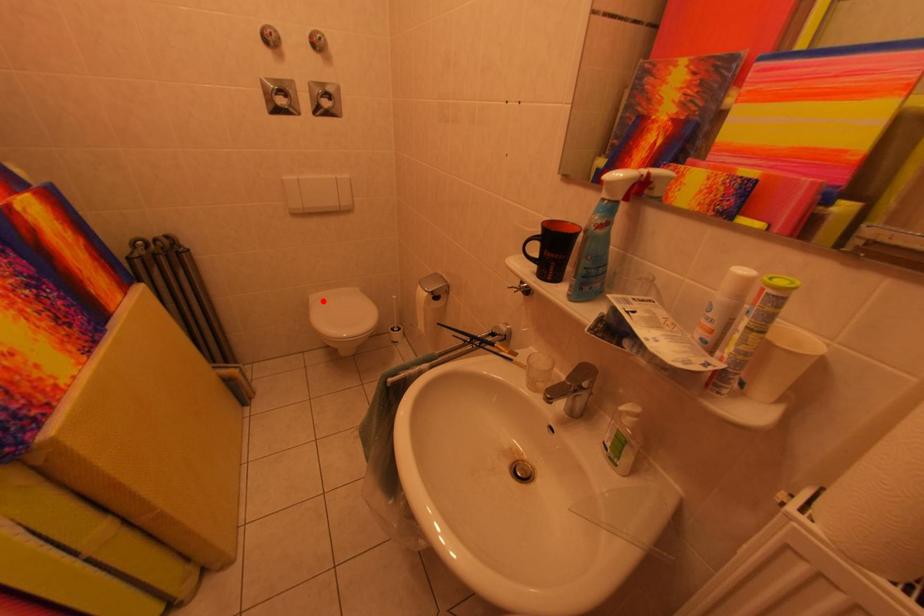
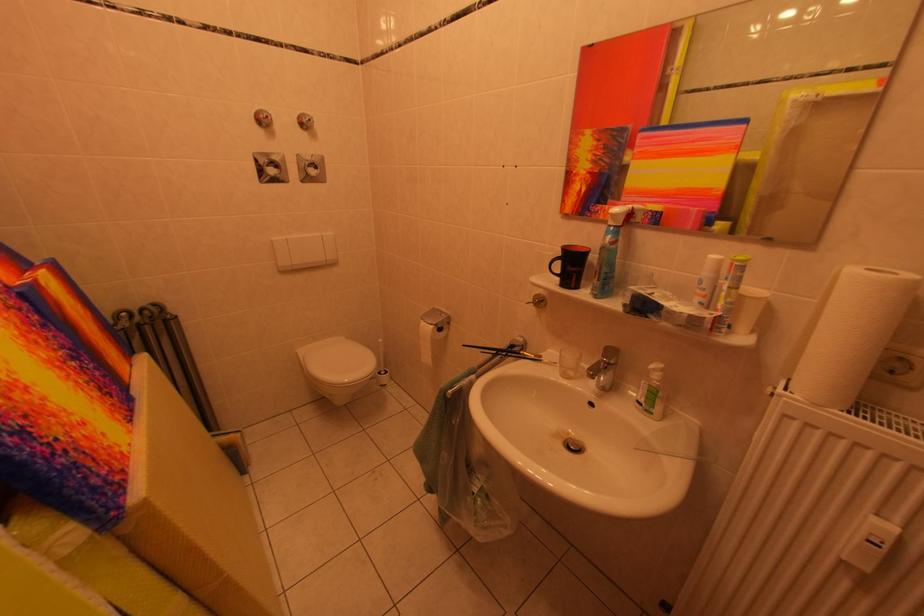
Question: I am providing you with two images of the same scene from different viewpoints. A red point is shown in image1. For the corresponding object point in image2, is it positioned nearer or farther from the camera?

Choices:
 (A) Nearer
 (B) Farther

Answer: (A)